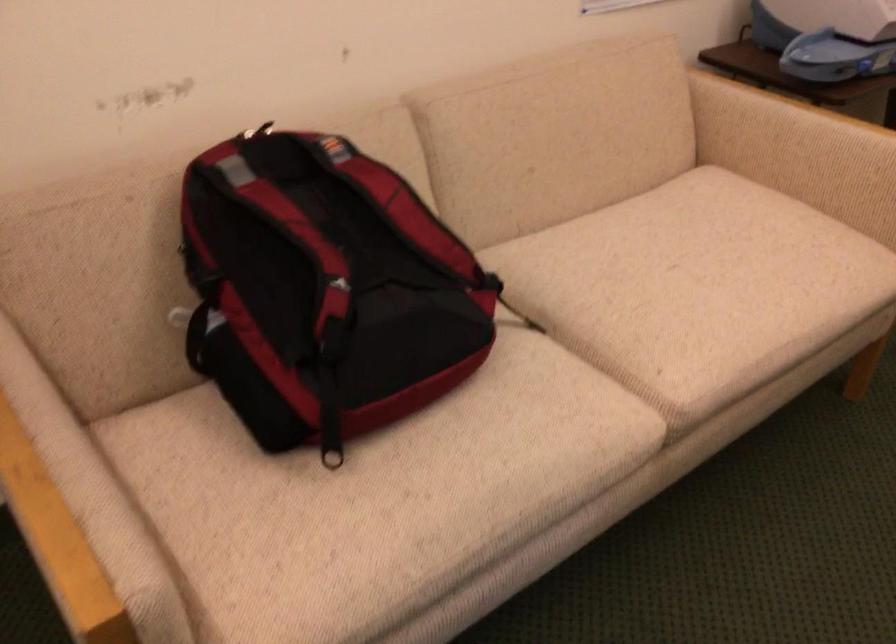
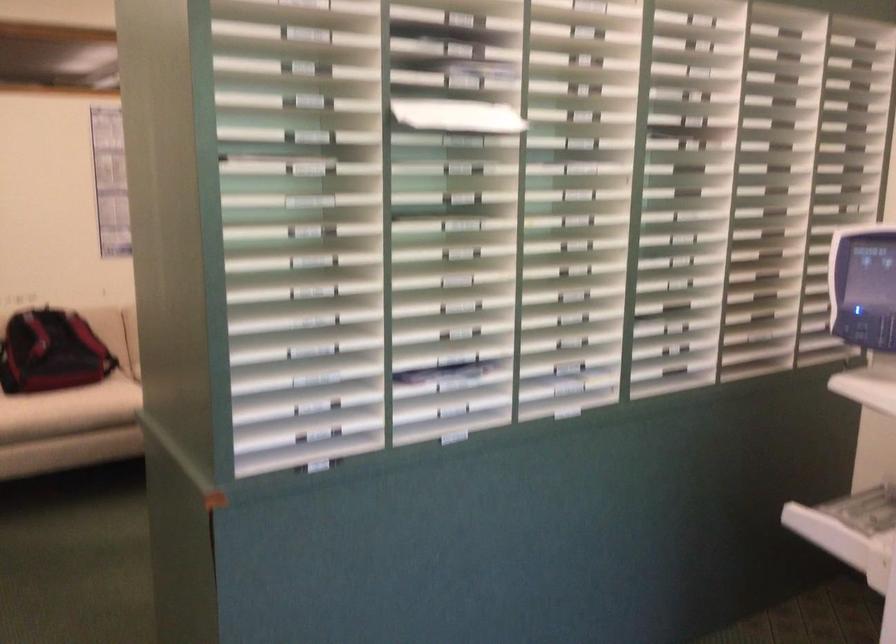
In a continuous first-person perspective shot, in which direction is the camera moving?

The movement direction of the cameraman is right, backward.